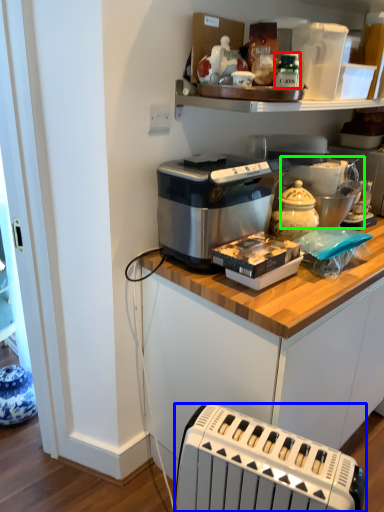
Question: Which object is positioned closest to bottle (highlighted by a red box)? Select from toaster (highlighted by a blue box) and appliance (highlighted by a green box).

Choices:
 (A) toaster
 (B) appliance

Answer: (B)